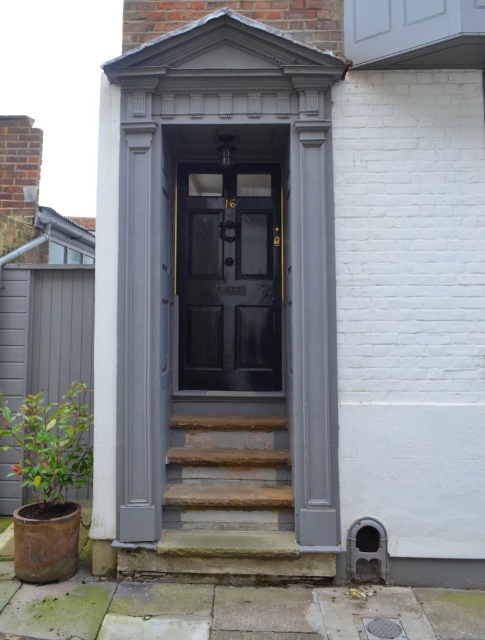
Question: Is matte black door at center smaller than natural stone stairs at center?

Choices:
 (A) yes
 (B) no

Answer: (A)

Question: Which object is the closest to the matte black door at center?

Choices:
 (A) green leafy plant at lower left
 (B) natural stone stairs at center

Answer: (B)

Question: Which point is closer to the camera taking this photo?

Choices:
 (A) (179, 308)
 (B) (210, 550)

Answer: (B)

Question: Which of the following is the closest to the observer?

Choices:
 (A) (21, 412)
 (B) (209, 444)
 (C) (260, 280)

Answer: (A)

Question: Is natural stone stairs at center to the right of green leafy plant at lower left from the viewer's perspective?

Choices:
 (A) yes
 (B) no

Answer: (A)

Question: From the image, what is the correct spatial relationship of matte black door at center in relation to natural stone stairs at center?

Choices:
 (A) above
 (B) below

Answer: (A)